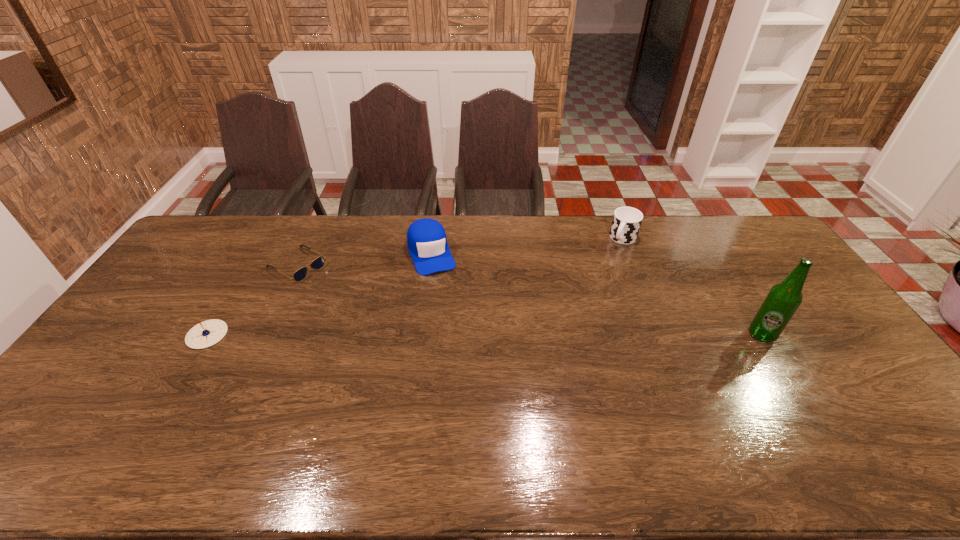
Locate an element on the screen. Image resolution: width=960 pixels, height=540 pixels. vacant space on the desktop that is between the compass and the beer bottle and is positioned on the front-facing side of the baseball cap is located at coordinates (464, 335).

At what (x,y) coordinates should I click in order to perform the action: click on free space on the desktop that is between the fourth tallest object and the rightmost object and is positioned on the front-facing side of the shortest object. Please return your answer as a coordinate pair (x, y). The image size is (960, 540). Looking at the image, I should click on (408, 335).

Where is `vacant space on the desktop that is between the second shortest object and the tallest object and is positioned on the side of the cup with the handle`? vacant space on the desktop that is between the second shortest object and the tallest object and is positioned on the side of the cup with the handle is located at coordinates (560, 335).